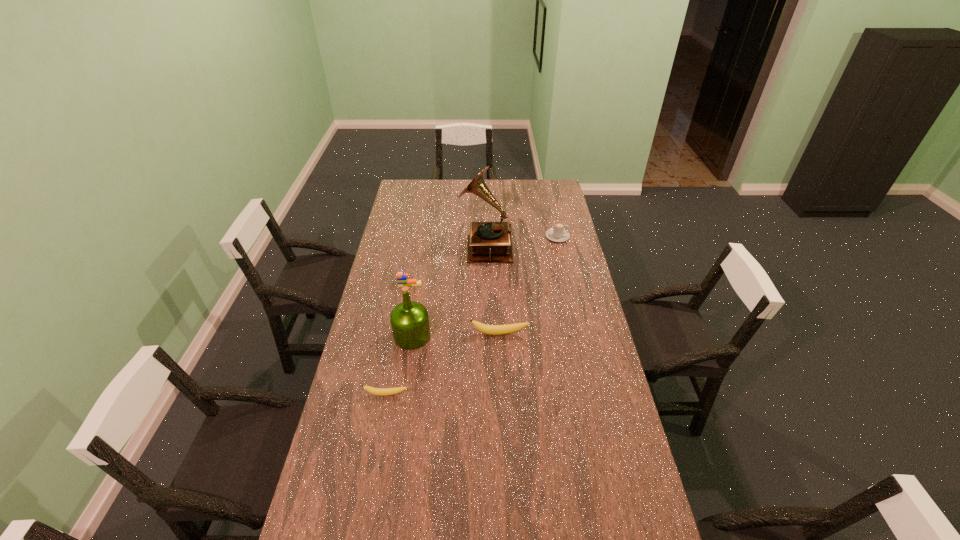
Identify the location of free spot between the record player and the farther banana. Image resolution: width=960 pixels, height=540 pixels. (492, 290).

Identify the location of vacant area that lies between the cappuccino and the tallest object. (521, 241).

Locate an element on the screen. The width and height of the screenshot is (960, 540). vacant area that lies between the tallest object and the taller banana is located at coordinates (492, 290).

At what (x,y) coordinates should I click in order to perform the action: click on free spot between the third farthest object and the taller banana. Please return your answer as a coordinate pair (x, y). The height and width of the screenshot is (540, 960). Looking at the image, I should click on pyautogui.click(x=455, y=308).

Identify which object is the fourth nearest to the cappuccino. Please provide its 2D coordinates. Your answer should be formatted as a tuple, i.e. [(x, y)], where the tuple contains the x and y coordinates of a point satisfying the conditions above.

[(409, 320)]

This screenshot has width=960, height=540. In order to click on object that is the fourth closest to the record player in this screenshot , I will do `click(509, 328)`.

Locate an element on the screen. The image size is (960, 540). vacant space that satisfies the following two spatial constraints: 1. to the right of the rightmost object; 2. on the upward curve of the shortest object is located at coordinates (593, 395).

At what (x,y) coordinates should I click in order to perform the action: click on free space that satisfies the following two spatial constraints: 1. to the right of the cappuccino; 2. on the front side of the olive oil. Please return your answer as a coordinate pair (x, y). The width and height of the screenshot is (960, 540). Looking at the image, I should click on (580, 336).

Identify the location of vacant space that satisfies the following two spatial constraints: 1. on the horn of the tallest object; 2. on the front side of the fifth tallest object. The height and width of the screenshot is (540, 960). (486, 282).

You are a GUI agent. You are given a task and a screenshot of the screen. Output one action in this format:
    pyautogui.click(x=<x>, y=<y>)
    Task: Click on the free space that satisfies the following two spatial constraints: 1. on the horn of the tallest object; 2. on the front side of the olive oil
    The height and width of the screenshot is (540, 960).
    Given the screenshot: What is the action you would take?
    pyautogui.click(x=487, y=336)